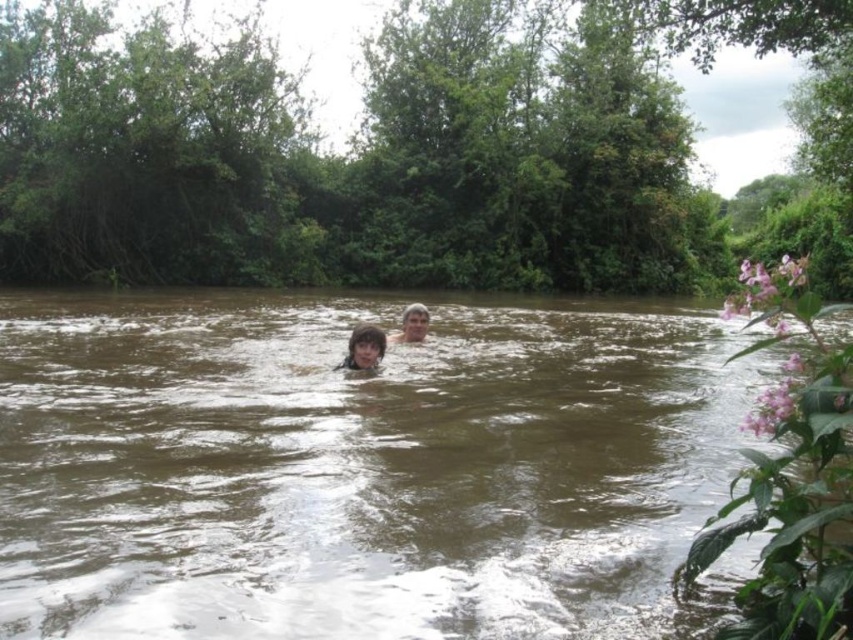
What do you see at coordinates (364, 348) in the screenshot?
I see `brown hair at center` at bounding box center [364, 348].

Does brown hair at center appear on the left side of light brown hair at center?

Indeed, brown hair at center is positioned on the left side of light brown hair at center.

Does point (367, 346) come behind point (422, 333)?

No, it is not.

Find the location of `brown hair at center`. brown hair at center is located at coordinates (364, 348).

Between brown muddy water at center and brown hair at center, which one has more height?

With more height is brown muddy water at center.

Which is behind, point (550, 362) or point (381, 339)?

The point (550, 362) is behind.

Does point (265, 486) come behind point (358, 364)?

No, (265, 486) is in front of (358, 364).

This screenshot has height=640, width=853. I want to click on brown muddy water at center, so click(363, 467).

Based on the photo, between brown muddy water at center and light brown hair at center, which one has more height?

brown muddy water at center is taller.

Between brown muddy water at center and light brown hair at center, which one is positioned higher?

light brown hair at center is above.

Does point (157, 531) come closer to viewer compared to point (412, 333)?

Yes.

Where is `brown muddy water at center`? brown muddy water at center is located at coordinates (363, 467).